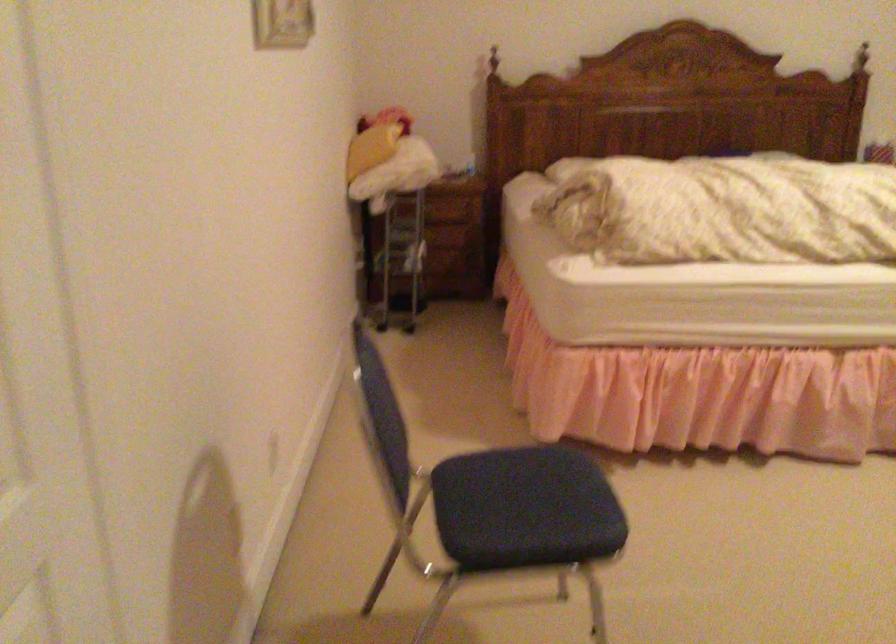
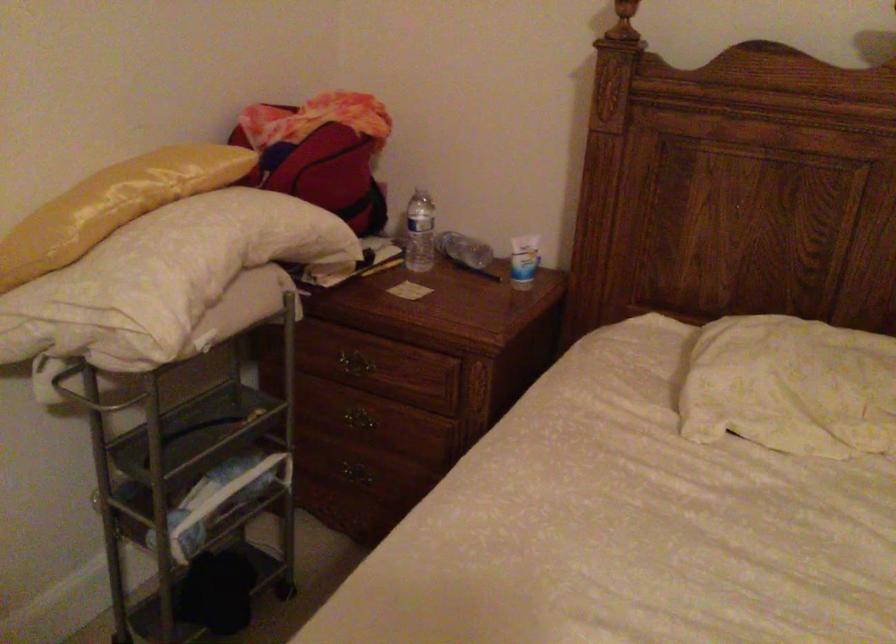
Locate, in the second image, the point that corresponds to pixel 468 152 in the first image.

(523, 261)